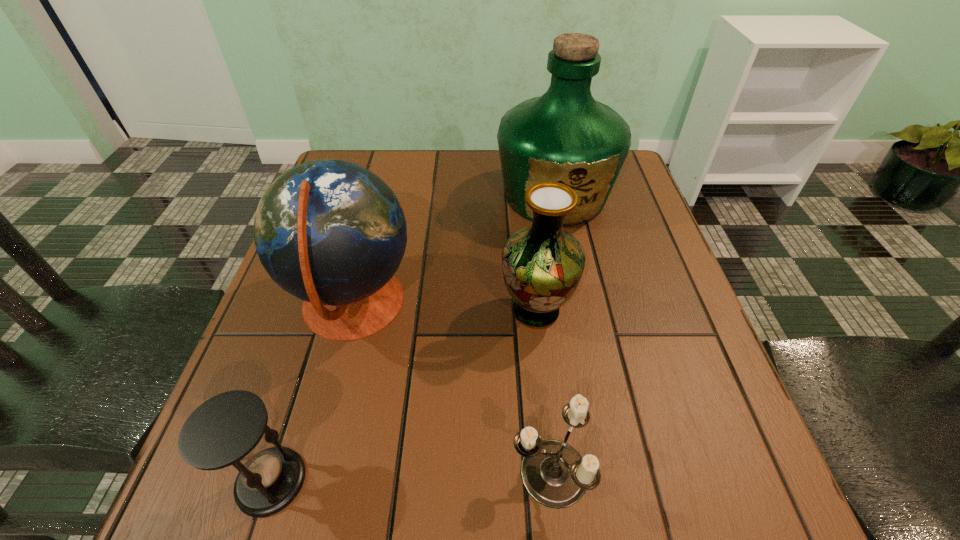
Identify the location of free space between the hourglass and the tallest object. (413, 339).

Locate an element on the screen. The image size is (960, 540). blank region between the farthest object and the globe is located at coordinates (454, 251).

Identify which object is located as the fourth nearest to the vase. Please provide its 2D coordinates. Your answer should be formatted as a tuple, i.e. [(x, y)], where the tuple contains the x and y coordinates of a point satisfying the conditions above.

[(225, 430)]

The height and width of the screenshot is (540, 960). I want to click on the third closest object to the tallest object, so click(x=554, y=474).

Where is `vacant point that satisfies the following two spatial constraints: 1. on the label side of the tallest object; 2. with the Americas facing the viewer on the globe`? The height and width of the screenshot is (540, 960). vacant point that satisfies the following two spatial constraints: 1. on the label side of the tallest object; 2. with the Americas facing the viewer on the globe is located at coordinates (576, 305).

This screenshot has width=960, height=540. In order to click on vacant space that satisfies the following two spatial constraints: 1. with the Americas facing the viewer on the globe; 2. on the back side of the vase in this screenshot , I will do pos(351,311).

I want to click on free space that satisfies the following two spatial constraints: 1. on the label side of the liquor; 2. with the Americas facing the viewer on the globe, so click(x=576, y=305).

This screenshot has width=960, height=540. Find the location of `free space in the image that satisfies the following two spatial constraints: 1. on the label side of the farthest object; 2. with the Americas facing the viewer on the globe`. free space in the image that satisfies the following two spatial constraints: 1. on the label side of the farthest object; 2. with the Americas facing the viewer on the globe is located at coordinates (576, 305).

Find the location of a particular element. Image resolution: width=960 pixels, height=540 pixels. vacant point that satisfies the following two spatial constraints: 1. on the back side of the vase; 2. on the right side of the hourglass is located at coordinates (324, 311).

Identify the location of vacant point that satisfies the following two spatial constraints: 1. with the Americas facing the viewer on the shortest object; 2. on the left side of the globe. (309, 472).